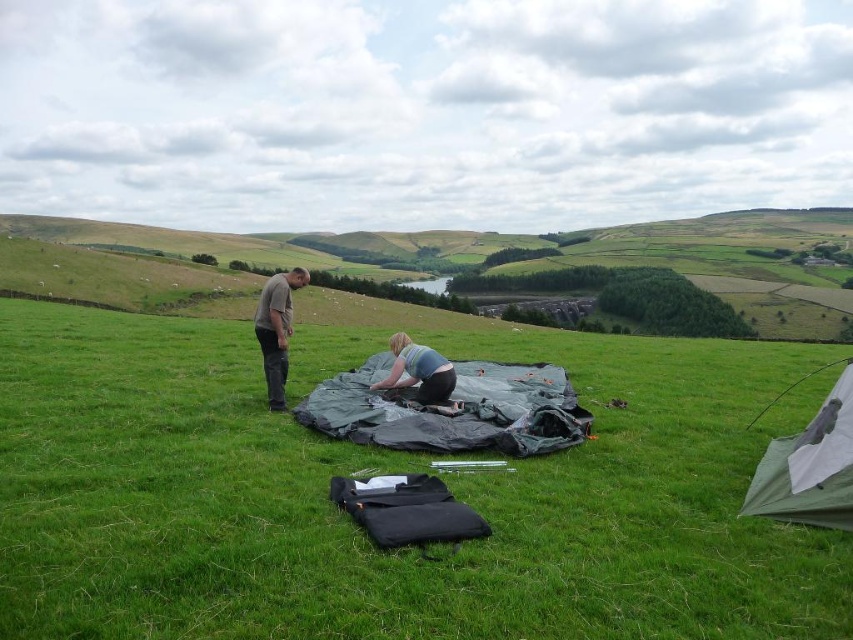
Can you confirm if green tarp at center is positioned above green fabric tent at center?

Yes, green tarp at center is above green fabric tent at center.

Can you confirm if green tarp at center is shorter than green fabric tent at center?

Correct, green tarp at center is not as tall as green fabric tent at center.

At what (x,y) coordinates should I click in order to perform the action: click on green tarp at center. Please return your answer as a coordinate pair (x, y). The width and height of the screenshot is (853, 640). Looking at the image, I should click on (456, 413).

Which of these two, gray cotton shirt at left or light blue fabric at center, stands shorter?

Standing shorter between the two is light blue fabric at center.

Which is in front, point (288, 304) or point (410, 346)?

Point (288, 304) is in front.

Locate an element on the screen. gray cotton shirt at left is located at coordinates (276, 330).

The height and width of the screenshot is (640, 853). I want to click on green fabric tent at center, so click(809, 467).